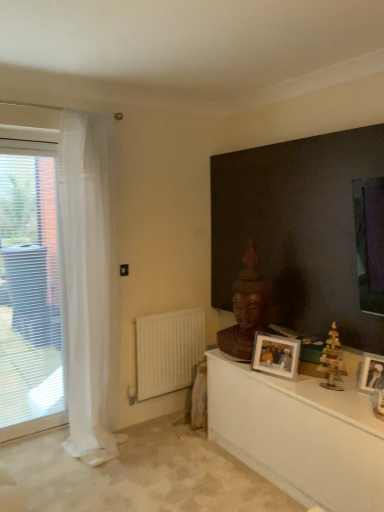
You are a GUI agent. You are given a task and a screenshot of the screen. Output one action in this format:
    pyautogui.click(x=<x>, y=<y>)
    Task: Click on the vacant region to the left of white sheer curtain at left
    
    Given the screenshot: What is the action you would take?
    pyautogui.click(x=41, y=455)